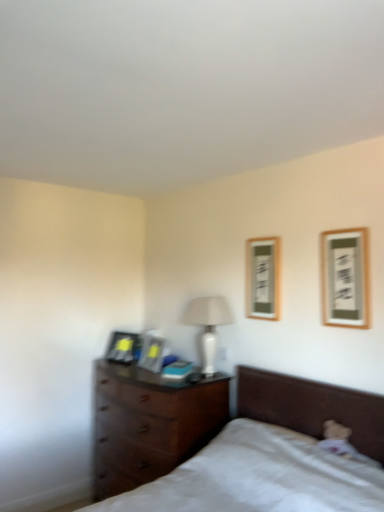
What do you see at coordinates (263, 278) in the screenshot?
I see `wooden picture frame at upper right, arranged as the third picture frame when viewed from the back` at bounding box center [263, 278].

This screenshot has width=384, height=512. What do you see at coordinates (150, 424) in the screenshot?
I see `dark wood chest of drawers at lower left` at bounding box center [150, 424].

Where is `dark wood chest of drawers at lower left`? The image size is (384, 512). dark wood chest of drawers at lower left is located at coordinates tap(150, 424).

Describe the element at coordinates (152, 353) in the screenshot. The width and height of the screenshot is (384, 512). I see `matte black picture frame at center, which appears as the second picture frame when viewed from the back` at that location.

The width and height of the screenshot is (384, 512). I want to click on white matte bed at lower right, so click(159, 439).

Locate an element on the screen. The width and height of the screenshot is (384, 512). wooden framed picture at upper right, the 1th picture frame in the right-to-left sequence is located at coordinates (345, 278).

Based on the photo, from the image's perspective, would you say matte black picture frame at center, which is the 2th picture frame from left to right, is positioned over matte black picture frame at left, positioned as the first picture frame in back-to-front order?

Indeed, from the image's perspective, matte black picture frame at center, which is the 2th picture frame from left to right, is shown above matte black picture frame at left, positioned as the first picture frame in back-to-front order.

From a real-world perspective, is matte black picture frame at center, which is the 3th picture frame in front-to-back order, positioned over matte black picture frame at left, which ranks as the 1th picture frame in left-to-right order, based on gravity?

Yes, from a real-world perspective, matte black picture frame at center, which is the 3th picture frame in front-to-back order, is over matte black picture frame at left, which ranks as the 1th picture frame in left-to-right order

Is matte black picture frame at left, positioned as the first picture frame in back-to-front order, located within matte black picture frame at center, which is the 3th picture frame in front-to-back order?

No, matte black picture frame at left, positioned as the first picture frame in back-to-front order, is not inside matte black picture frame at center, which is the 3th picture frame in front-to-back order.

Can you confirm if white matte bed at lower right is shorter than wooden picture frame at upper right, marked as the 2th picture frame in a right-to-left arrangement?

Incorrect, the height of white matte bed at lower right does not fall short of that of wooden picture frame at upper right, marked as the 2th picture frame in a right-to-left arrangement.

From a real-world perspective, is white matte bed at lower right on top of wooden picture frame at upper right, arranged as the third picture frame when viewed from the back?

Actually, white matte bed at lower right is physically below wooden picture frame at upper right, arranged as the third picture frame when viewed from the back, in the real world.

Does white matte bed at lower right appear on the left side of wooden picture frame at upper right, marked as the 2th picture frame in a right-to-left arrangement?

Indeed, white matte bed at lower right is positioned on the left side of wooden picture frame at upper right, marked as the 2th picture frame in a right-to-left arrangement.

The image size is (384, 512). I want to click on the 1st picture frame to the right of the white matte bed at lower right, counting from the anchor's position, so click(x=263, y=278).

How many degrees apart are the facing directions of wooden framed picture at upper right, the fourth picture frame in the left-to-right sequence, and white matte bed at lower right?

The facing directions of wooden framed picture at upper right, the fourth picture frame in the left-to-right sequence, and white matte bed at lower right are 0.00671 degrees apart.

From the image's perspective, is wooden framed picture at upper right, the 1th picture frame in the right-to-left sequence, above or below white matte bed at lower right?

From the image's perspective, wooden framed picture at upper right, the 1th picture frame in the right-to-left sequence, appears above white matte bed at lower right.

Measure the distance between wooden framed picture at upper right, the fourth picture frame in the left-to-right sequence, and white matte bed at lower right.

wooden framed picture at upper right, the fourth picture frame in the left-to-right sequence, is 86.09 centimeters away from white matte bed at lower right.

From a real-world perspective, which is physically above, wooden framed picture at upper right, the fourth picture frame positioned from the back, or white matte bed at lower right?

wooden framed picture at upper right, the fourth picture frame positioned from the back.

Would you say wooden picture frame at upper right, which appears as the second picture frame when viewed from the front, contains white glossy table lamp at center?

That's incorrect, white glossy table lamp at center is not inside wooden picture frame at upper right, which appears as the second picture frame when viewed from the front.

Is wooden picture frame at upper right, marked as the 2th picture frame in a right-to-left arrangement, positioned with its back to white glossy table lamp at center?

No, white glossy table lamp at center is not at the back of wooden picture frame at upper right, marked as the 2th picture frame in a right-to-left arrangement.

Which object is closer to the camera taking this photo, wooden picture frame at upper right, placed as the 3th picture frame when sorted from left to right, or white glossy table lamp at center?

wooden picture frame at upper right, placed as the 3th picture frame when sorted from left to right, is closer to the camera.

Between wooden picture frame at upper right, which appears as the second picture frame when viewed from the front, and white glossy table lamp at center, which one appears on the left side from the viewer's perspective?

white glossy table lamp at center is more to the left.

Is matte black picture frame at center, acting as the third picture frame starting from the right, oriented towards white matte bed at lower right?

No.

From the picture: Is matte black picture frame at center, which is the 3th picture frame in front-to-back order, taller or shorter than white matte bed at lower right?

Considering their sizes, matte black picture frame at center, which is the 3th picture frame in front-to-back order, has less height than white matte bed at lower right.

From the image's perspective, relative to white matte bed at lower right, is matte black picture frame at center, which is the 3th picture frame in front-to-back order, above or below?

matte black picture frame at center, which is the 3th picture frame in front-to-back order, is situated higher than white matte bed at lower right in the image.

From a real-world perspective, relative to wooden framed picture at upper right, the fourth picture frame positioned from the back, is white matte bed at lower right vertically above or below?

white matte bed at lower right is situated lower than wooden framed picture at upper right, the fourth picture frame positioned from the back, in the real world.

Is white matte bed at lower right taller or shorter than wooden framed picture at upper right, the fourth picture frame positioned from the back?

white matte bed at lower right is taller than wooden framed picture at upper right, the fourth picture frame positioned from the back.

Would you say white matte bed at lower right is a long distance from wooden framed picture at upper right, the 1th picture frame in the right-to-left sequence?

That's not correct — white matte bed at lower right is a little close to wooden framed picture at upper right, the 1th picture frame in the right-to-left sequence.

Would you say white matte bed at lower right is inside or outside wooden framed picture at upper right, the first picture frame from the front?

white matte bed at lower right is not enclosed by wooden framed picture at upper right, the first picture frame from the front.

The height and width of the screenshot is (512, 384). There is a wooden framed picture at upper right, the first picture frame from the front. What are the coordinates of `the 1st picture frame below it (from the image's perspective)` in the screenshot? It's located at (263, 278).

Which object is further away from the camera taking this photo, wooden framed picture at upper right, the fourth picture frame in the left-to-right sequence, or wooden picture frame at upper right, placed as the 3th picture frame when sorted from left to right?

wooden picture frame at upper right, placed as the 3th picture frame when sorted from left to right, is further away from the camera.

Does point (333, 303) lie in front of point (269, 292)?

Yes, point (333, 303) is closer to viewer.

Consider the image. Would you say wooden picture frame at upper right, placed as the 3th picture frame when sorted from left to right, is part of wooden framed picture at upper right, the 1th picture frame in the right-to-left sequence,'s contents?

No, wooden picture frame at upper right, placed as the 3th picture frame when sorted from left to right, is not surrounded by wooden framed picture at upper right, the 1th picture frame in the right-to-left sequence.

Which picture frame is the 1st one when counting from the front of the matte black picture frame at left, the 4th picture frame from the front? Please provide its 2D coordinates.

[(152, 353)]

Locate an element on the screen. The height and width of the screenshot is (512, 384). bed lying on the left of wooden picture frame at upper right, marked as the 2th picture frame in a right-to-left arrangement is located at coordinates (159, 439).

Looking at the image, which one is located closer to white glossy table lamp at center, dark wood chest of drawers at lower left or wooden picture frame at upper right, which appears as the second picture frame when viewed from the front?

wooden picture frame at upper right, which appears as the second picture frame when viewed from the front, is positioned closer to the anchor white glossy table lamp at center.

Based on their spatial positions, is white matte bed at lower right or white glossy table lamp at center closer to matte black picture frame at left, positioned as the first picture frame in back-to-front order?

white glossy table lamp at center.

Based on their spatial positions, is dark wood chest of drawers at lower left or white glossy table lamp at center closer to matte black picture frame at center, which is the 3th picture frame in front-to-back order?

dark wood chest of drawers at lower left is positioned closer to the anchor matte black picture frame at center, which is the 3th picture frame in front-to-back order.

Based on their spatial positions, is white glossy table lamp at center or wooden picture frame at upper right, arranged as the third picture frame when viewed from the back, further from wooden framed picture at upper right, the first picture frame from the front?

white glossy table lamp at center.

Looking at this image, looking at the image, which one is located further to white matte bed at lower right, white glossy table lamp at center or matte black picture frame at center, which appears as the second picture frame when viewed from the back?

Based on the image, matte black picture frame at center, which appears as the second picture frame when viewed from the back, appears to be further to white matte bed at lower right.

Considering their positions, is white glossy table lamp at center positioned closer to matte black picture frame at left, positioned as the first picture frame in back-to-front order, than white matte bed at lower right?

Among the two, white glossy table lamp at center is located nearer to matte black picture frame at left, positioned as the first picture frame in back-to-front order.

Which object lies further to the anchor point dark wood chest of drawers at lower left, white glossy table lamp at center or wooden framed picture at upper right, the fourth picture frame positioned from the back?

wooden framed picture at upper right, the fourth picture frame positioned from the back, is further to dark wood chest of drawers at lower left.

Considering their positions, is dark wood chest of drawers at lower left positioned closer to wooden picture frame at upper right, placed as the 3th picture frame when sorted from left to right, than white matte bed at lower right?

white matte bed at lower right is closer to wooden picture frame at upper right, placed as the 3th picture frame when sorted from left to right.

In order to click on chest of drawers between matte black picture frame at center, which is the 3th picture frame in front-to-back order, and wooden framed picture at upper right, the fourth picture frame positioned from the back, in the horizontal direction in this screenshot , I will do `click(150, 424)`.

At what (x,y) coordinates should I click in order to perform the action: click on chest of drawers between white matte bed at lower right and matte black picture frame at left, which ranks as the 1th picture frame in left-to-right order, from front to back. Please return your answer as a coordinate pair (x, y). The width and height of the screenshot is (384, 512). Looking at the image, I should click on (150, 424).

Where is `chest of drawers between matte black picture frame at left, positioned as the first picture frame in back-to-front order, and wooden framed picture at upper right, the 1th picture frame in the right-to-left sequence, from left to right`? The width and height of the screenshot is (384, 512). chest of drawers between matte black picture frame at left, positioned as the first picture frame in back-to-front order, and wooden framed picture at upper right, the 1th picture frame in the right-to-left sequence, from left to right is located at coordinates point(150,424).

Locate an element on the screen. The width and height of the screenshot is (384, 512). table lamp between matte black picture frame at center, which is the 2th picture frame from left to right, and wooden framed picture at upper right, the first picture frame from the front is located at coordinates (208, 325).